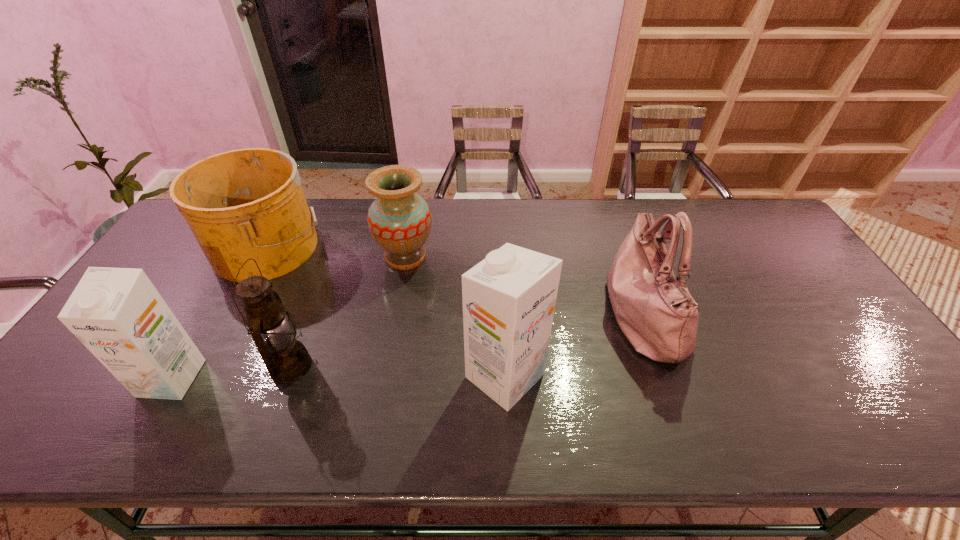
The height and width of the screenshot is (540, 960). Find the location of `object that is at the far left corner`. object that is at the far left corner is located at coordinates (247, 203).

Identify the location of vacant position at the far edge of the desktop. The width and height of the screenshot is (960, 540). coord(463,204).

This screenshot has width=960, height=540. In the image, there is a desktop. In order to click on vacant space at the near edge in this screenshot , I will do `click(247, 385)`.

In the image, there is a desktop. Identify the location of vacant space at the left edge. (195, 256).

Locate an element on the screen. Image resolution: width=960 pixels, height=540 pixels. free space at the right edge of the desktop is located at coordinates (791, 271).

This screenshot has height=540, width=960. In the image, there is a desktop. What are the coordinates of `free space at the near right corner` in the screenshot? It's located at (869, 401).

The image size is (960, 540). I want to click on blank region between the bucket and the rightmost object, so click(x=455, y=280).

Locate an element on the screen. The width and height of the screenshot is (960, 540). empty location between the oil lamp and the right carton is located at coordinates (398, 371).

Find the location of `empty space between the vase and the bucket`. empty space between the vase and the bucket is located at coordinates coord(337,252).

Where is `empty space that is in between the left carton and the oil lamp`? This screenshot has height=540, width=960. empty space that is in between the left carton and the oil lamp is located at coordinates (231, 372).